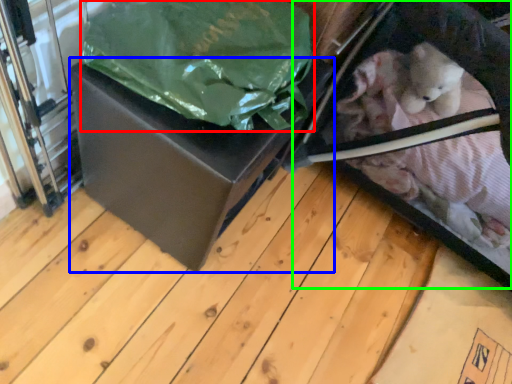
Question: Which is nearer to the plastic bag (highlighted by a red box)? box (highlighted by a blue box) or baby carriage (highlighted by a green box).

Choices:
 (A) box
 (B) baby carriage

Answer: (A)